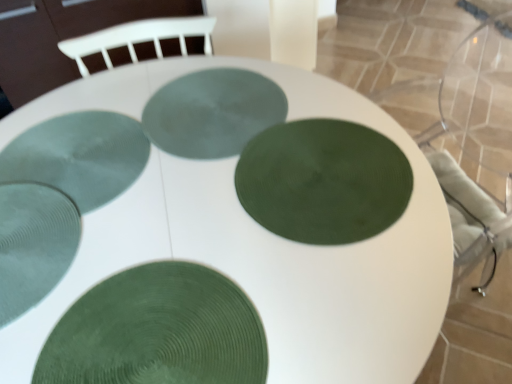
Find the location of a particular element. Image resolution: width=512 pixels, height=384 pixels. blank area beneath clear textured glass at bottom left, positioned as the 2th glass plate in front-to-back order (from a real-world perspective) is located at coordinates (26, 248).